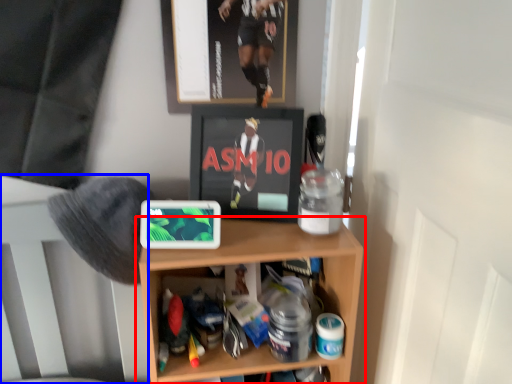
Question: Which of the following is the closest to the observer, shelf (highlighted by a red box) or bed frame (highlighted by a blue box)?

Choices:
 (A) shelf
 (B) bed frame

Answer: (A)